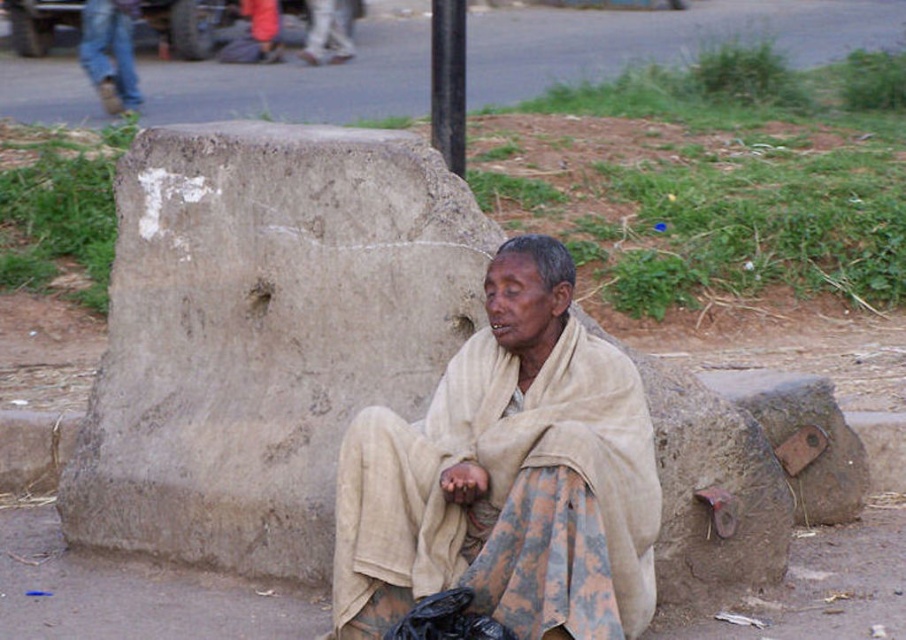
Which is below, gray concrete block at center or gray concrete pavement at upper center?

gray concrete block at center is below.

What are the coordinates of `gray concrete block at center` in the screenshot? It's located at (264, 333).

Who is shorter, gray concrete pavement at upper center or black metal pole at upper center?

black metal pole at upper center is shorter.

Does gray concrete pavement at upper center lie in front of black metal pole at upper center?

That is False.

Does point (214, 83) come behind point (449, 19)?

That is True.

The width and height of the screenshot is (906, 640). I want to click on gray concrete pavement at upper center, so click(x=657, y=38).

Is beige fabric at center shorter than gray concrete pavement at upper center?

Yes, beige fabric at center is shorter than gray concrete pavement at upper center.

Looking at this image, is beige fabric at center to the right of gray concrete pavement at upper center from the viewer's perspective?

No, beige fabric at center is not to the right of gray concrete pavement at upper center.

The height and width of the screenshot is (640, 906). In order to click on beige fabric at center in this screenshot , I will do `click(508, 474)`.